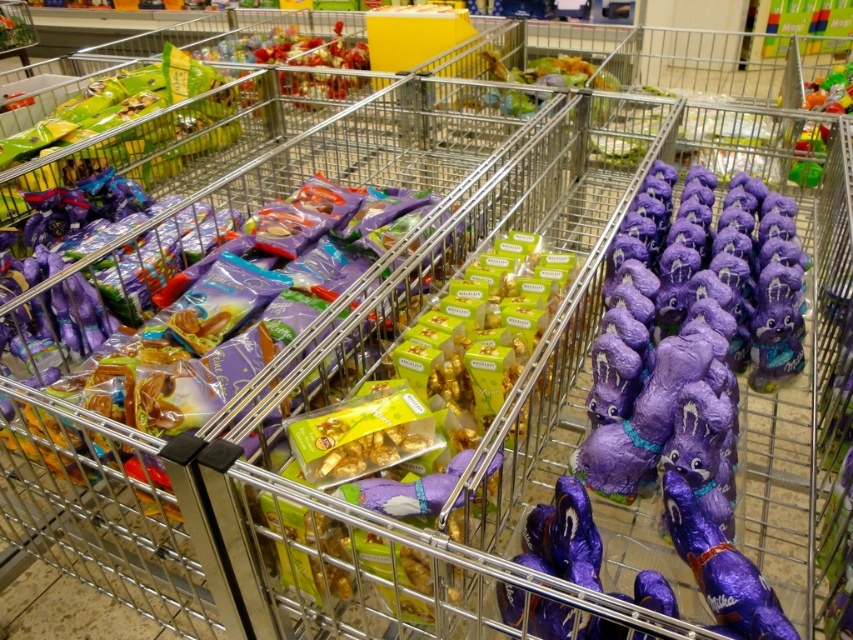
You are standing in front of the supermarket shelf and want to find the purple shiny chocolate bunny at right. Based on the shelf layout, can you determine its exact position relative to the other items?

The purple shiny chocolate bunny at right is located at point (689, 336), which means it is positioned slightly to the right and lower portion of the shelf compared to other items.

You are a store employee who needs to arrange these items on a shelf. Given that the purple shiny chocolate bunny at right is wider than the purple foil chocolate at center, which item requires more horizontal space for proper display?

The purple shiny chocolate bunny at right requires more horizontal space because its width is larger than the purple foil chocolate at center.